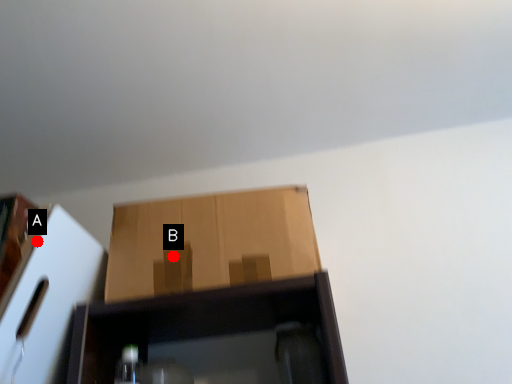
Question: Two points are circled on the image, labeled by A and B beside each circle. Among these points, which one is farthest from the camera?

Choices:
 (A) A is further
 (B) B is further

Answer: (B)